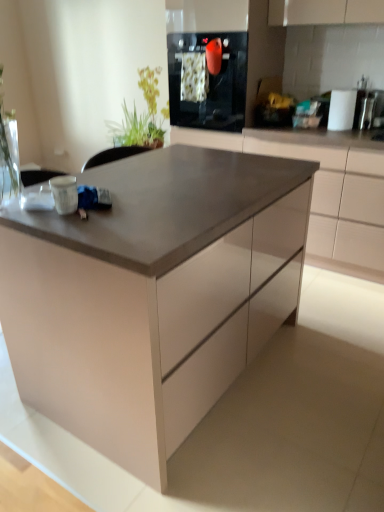
Question: Is matte gray table at center closer to the viewer compared to black glass oven at upper center?

Choices:
 (A) yes
 (B) no

Answer: (A)

Question: Can you confirm if matte gray table at center is taller than black glass oven at upper center?

Choices:
 (A) yes
 (B) no

Answer: (A)

Question: Is matte gray table at center next to black glass oven at upper center?

Choices:
 (A) yes
 (B) no

Answer: (B)

Question: Is matte gray table at center wider than black glass oven at upper center?

Choices:
 (A) no
 (B) yes

Answer: (B)

Question: Can you confirm if matte gray table at center is bigger than black glass oven at upper center?

Choices:
 (A) no
 (B) yes

Answer: (B)

Question: Looking at the image, does matte gray table at center seem bigger or smaller compared to matte white cabinet at center?

Choices:
 (A) big
 (B) small

Answer: (A)

Question: Is matte gray table at center wider or thinner than matte white cabinet at center?

Choices:
 (A) wide
 (B) thin

Answer: (A)

Question: Is point (9, 280) positioned closer to the camera than point (342, 168)?

Choices:
 (A) closer
 (B) farther

Answer: (A)

Question: From their relative heights in the image, would you say matte gray table at center is taller or shorter than matte white cabinet at center?

Choices:
 (A) tall
 (B) short

Answer: (A)

Question: Is point (147, 138) positioned closer to the camera than point (206, 82)?

Choices:
 (A) farther
 (B) closer

Answer: (A)

Question: From the image's perspective, relative to black glass oven at upper center, is green leafy plant at upper left above or below?

Choices:
 (A) above
 (B) below

Answer: (A)

Question: Is green leafy plant at upper left inside the boundaries of black glass oven at upper center, or outside?

Choices:
 (A) outside
 (B) inside

Answer: (A)

Question: Looking at the image, does green leafy plant at upper left seem bigger or smaller compared to black glass oven at upper center?

Choices:
 (A) small
 (B) big

Answer: (A)

Question: Is point (160, 138) closer or farther from the camera than point (278, 141)?

Choices:
 (A) farther
 (B) closer

Answer: (A)

Question: From the image's perspective, is green leafy plant at upper left above or below matte white cabinet at center?

Choices:
 (A) below
 (B) above

Answer: (B)